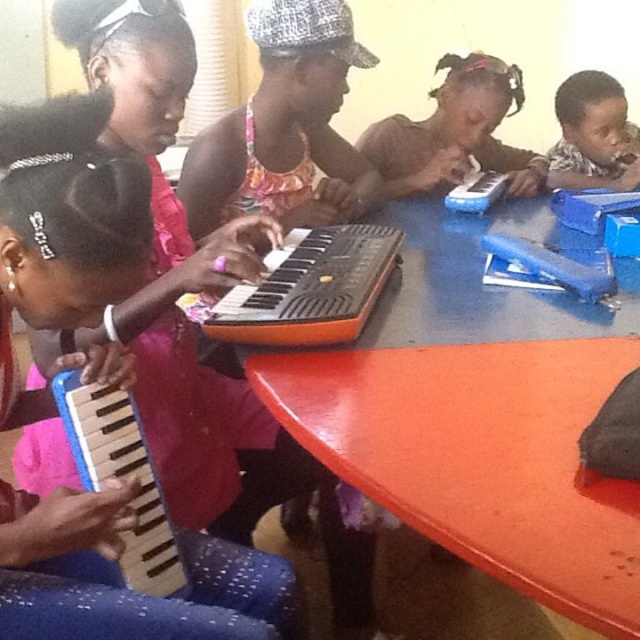
You are a music teacher setting up a classroom for a lesson. You have a blue plastic keyboard at lower left and a wooden accordion at lower left. You need to place them on a shelf that can only hold items up to 1 meter in height. Which item might not fit based on their height?

The blue plastic keyboard at lower left is much taller than the wooden accordion at lower left, so the blue plastic keyboard at lower left might not fit on the shelf since it exceeds the 1 meter height limit.

You are a music teacher in a classroom. You have an orange plastic keyboard at center and a wooden accordion at lower left. Which instrument should you choose to demonstrate to the class if you want to use the bigger one?

The orange plastic keyboard at center is larger in size than the wooden accordion at lower left, so you should choose the orange plastic keyboard at center to demonstrate.